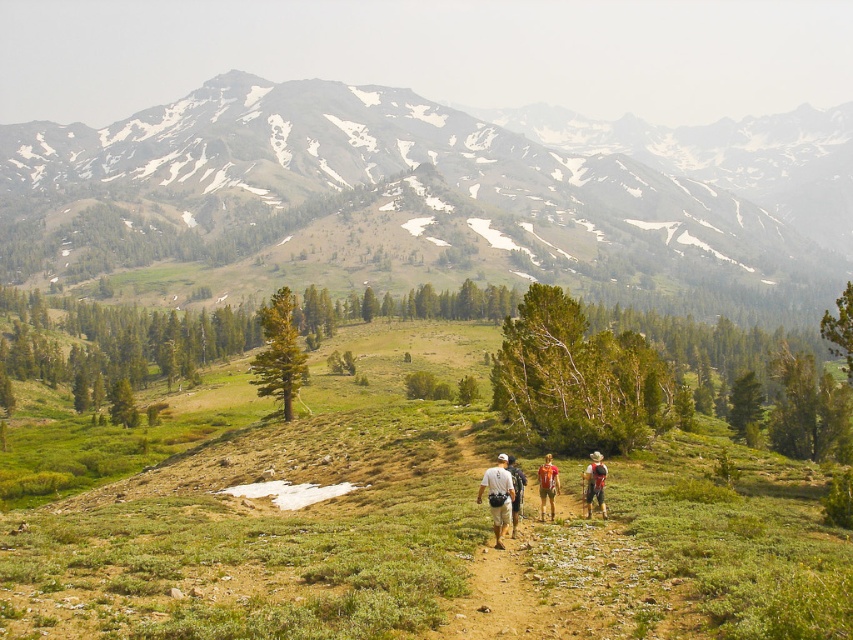
Question: Does white fabric backpack at center come in front of matte gray backpack at center?

Choices:
 (A) yes
 (B) no

Answer: (A)

Question: Which point is closer to the camera taking this photo?

Choices:
 (A) (223, 449)
 (B) (593, 486)
 (C) (496, 516)
 (D) (332, 104)

Answer: (C)

Question: Among these points, which one is nearest to the camera?

Choices:
 (A) (554, 492)
 (B) (498, 512)

Answer: (B)

Question: Is green grassy at center thinner than white fabric backpack at center?

Choices:
 (A) no
 (B) yes

Answer: (A)

Question: Is white fabric backpack at center bigger than camouflage fabric shorts at center?

Choices:
 (A) yes
 (B) no

Answer: (A)

Question: Considering the real-world distances, which object is farthest from the white fabric backpack at center?

Choices:
 (A) camouflage fabric shorts at center
 (B) green grassy mountain at upper center

Answer: (B)